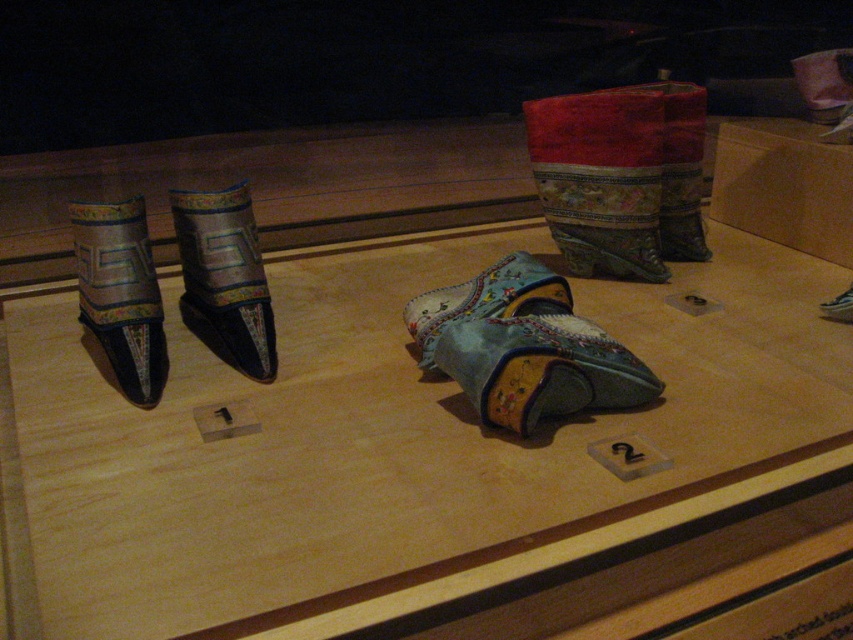
Question: Among these objects, which one is farthest from the camera?

Choices:
 (A) silk embroidered boot at left
 (B) matte blue fabric shoes at center

Answer: (A)

Question: Does light blue fabric shoe at center lie in front of silky satin boot at left?

Choices:
 (A) no
 (B) yes

Answer: (B)

Question: Does matte blue fabric shoes at center have a greater width compared to silky satin boot at left?

Choices:
 (A) no
 (B) yes

Answer: (B)

Question: Which of the following is the closest to the observer?

Choices:
 (A) (125, 307)
 (B) (543, 417)
 (C) (223, 336)
 (D) (223, 444)

Answer: (D)

Question: Based on their relative distances, which object is nearer to the light blue fabric shoe at center?

Choices:
 (A) silky satin boot at left
 (B) silk embroidered boot at left

Answer: (B)

Question: Does matte blue fabric shoes at center have a smaller size compared to silk embroidered boot at left?

Choices:
 (A) no
 (B) yes

Answer: (A)